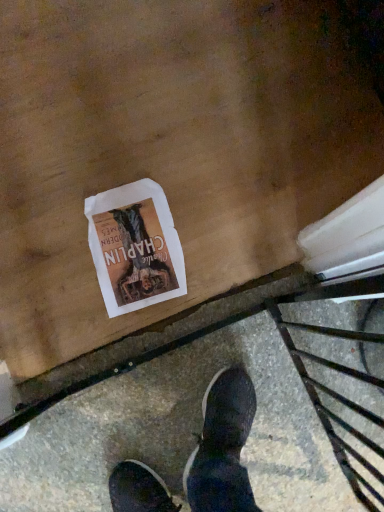
Question: From a real-world perspective, is white paper flyer at center on top of concrete pavement at lower center?

Choices:
 (A) yes
 (B) no

Answer: (B)

Question: Is white paper flyer at center smaller than concrete pavement at lower center?

Choices:
 (A) yes
 (B) no

Answer: (A)

Question: Are white paper flyer at center and concrete pavement at lower center located far from each other?

Choices:
 (A) yes
 (B) no

Answer: (B)

Question: Is the depth of white paper flyer at center less than that of concrete pavement at lower center?

Choices:
 (A) yes
 (B) no

Answer: (B)

Question: Is white paper flyer at center facing towards concrete pavement at lower center?

Choices:
 (A) no
 (B) yes

Answer: (A)

Question: Considering the relative sizes of white paper flyer at center and concrete pavement at lower center in the image provided, is white paper flyer at center taller than concrete pavement at lower center?

Choices:
 (A) yes
 (B) no

Answer: (B)

Question: From a real-world perspective, is concrete pavement at lower center below white paper flyer at center?

Choices:
 (A) no
 (B) yes

Answer: (A)

Question: Is white paper flyer at center a part of concrete pavement at lower center?

Choices:
 (A) yes
 (B) no

Answer: (B)

Question: Is concrete pavement at lower center positioned with its back to white paper flyer at center?

Choices:
 (A) no
 (B) yes

Answer: (B)

Question: Is concrete pavement at lower center to the right of white paper flyer at center from the viewer's perspective?

Choices:
 (A) yes
 (B) no

Answer: (A)

Question: Is concrete pavement at lower center taller than white paper flyer at center?

Choices:
 (A) no
 (B) yes

Answer: (B)

Question: Is concrete pavement at lower center facing towards white paper flyer at center?

Choices:
 (A) yes
 (B) no

Answer: (B)

Question: Is concrete pavement at lower center inside or outside of white paper flyer at center?

Choices:
 (A) outside
 (B) inside

Answer: (A)